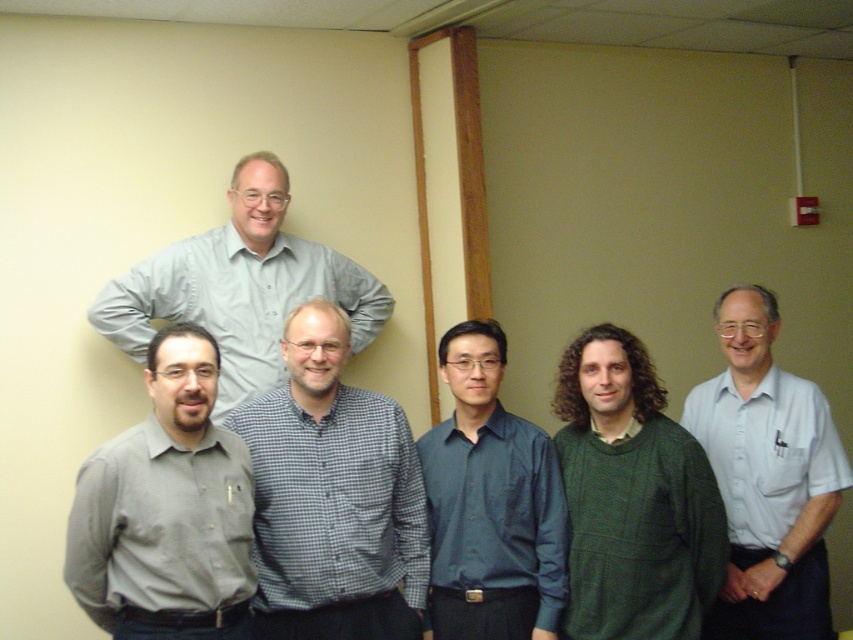
You are a photographer setting up for a group photo. You need to ensure that the gray matte shirt at lower left and the light gray shirt at upper center are at least 30 inches apart to frame them properly. Based on the scene description, can you confirm if they meet this requirement?

The gray matte shirt at lower left and the light gray shirt at upper center are 33.46 inches apart from each other, which is more than the required 30 inches. Therefore, they meet the framing requirement.

Consider the image. Based on the scene description, if you were standing in front of the group facing them, which of the two individuals wearing gray shirts, the gray matte shirt at lower left or the light gray shirt at upper center, would appear closer to your left side?

The gray matte shirt at lower left is to the left of light gray shirt at upper center, so the gray matte shirt at lower left would appear closer to your left side.

You are organizing a photo shoot and need to ensure that the gray checkered shirt at center and the light gray shirt at right are visible in the final shot. Based on their positions, which of the two shirts is closer to the camera?

The gray checkered shirt at center is positioned under the light gray shirt at right, meaning the light gray shirt at right is closer to the camera than the gray checkered shirt at center.